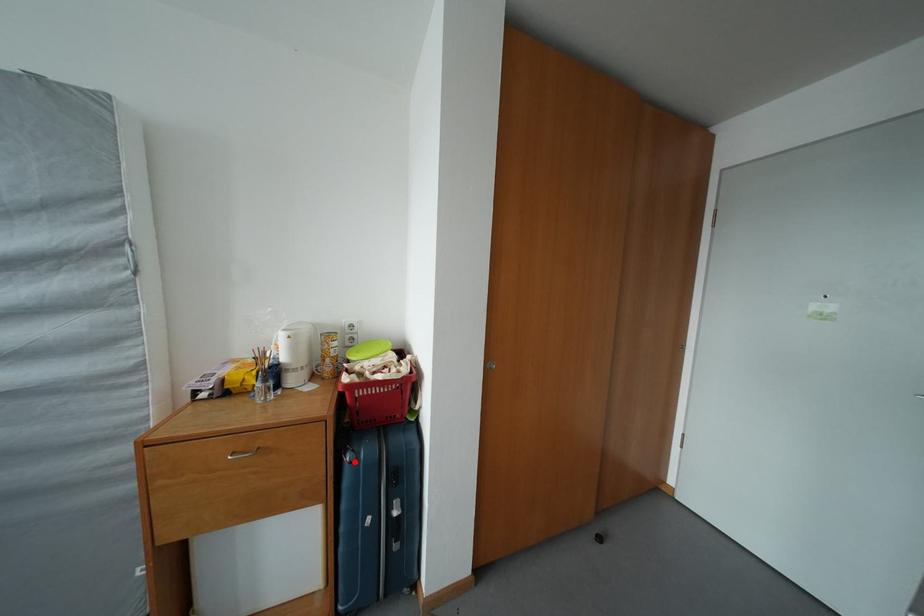
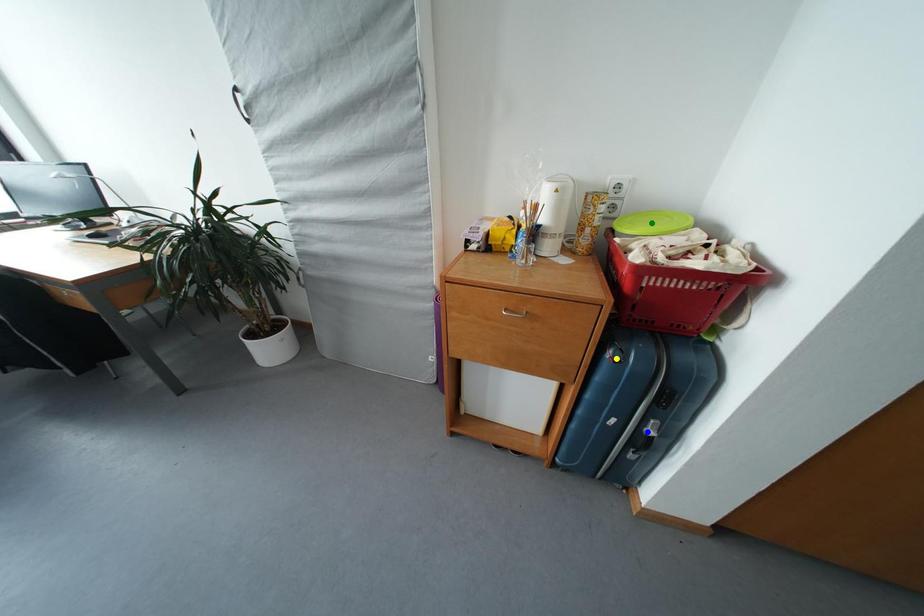
Question: I am providing you with two images of the same scene from different viewpoints. A red point is marked on the first image. You are given multiple points on the second image. In image 2, which mark is for the same physical point as the one in image 1?

Choices:
 (A) yellow point
 (B) green point
 (C) blue point

Answer: (A)